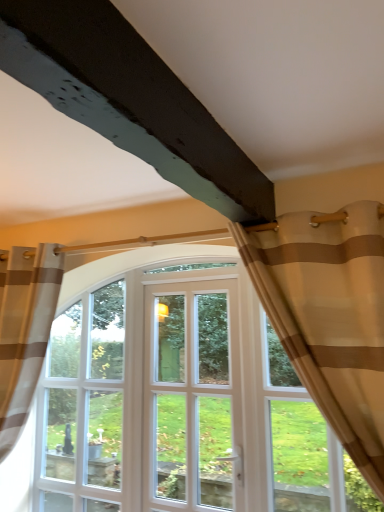
Question: Is brown striped curtain at left, positioned as the 2th curtain in front-to-back order, surrounding beige striped curtain at upper right, which is the first curtain from front to back?

Choices:
 (A) no
 (B) yes

Answer: (A)

Question: Can you confirm if brown striped curtain at left, positioned as the 2th curtain in front-to-back order, is thinner than beige striped curtain at upper right, which is the first curtain from front to back?

Choices:
 (A) yes
 (B) no

Answer: (B)

Question: Is brown striped curtain at left, positioned as the 2th curtain in front-to-back order, facing towards beige striped curtain at upper right, which is the first curtain from front to back?

Choices:
 (A) yes
 (B) no

Answer: (B)

Question: Is brown striped curtain at left, positioned as the 2th curtain in right-to-left order, smaller than beige striped curtain at upper right, which is the first curtain from right to left?

Choices:
 (A) no
 (B) yes

Answer: (A)

Question: Can you confirm if brown striped curtain at left, positioned as the 2th curtain in right-to-left order, is taller than beige striped curtain at upper right, the second curtain viewed from the left?

Choices:
 (A) no
 (B) yes

Answer: (B)

Question: Based on their positions, is beige striped curtain at upper right, the second curtain viewed from the left, located to the left or right of white glass door at center?

Choices:
 (A) left
 (B) right

Answer: (B)

Question: Is beige striped curtain at upper right, which is the second curtain in back-to-front order, bigger or smaller than white glass door at center?

Choices:
 (A) big
 (B) small

Answer: (A)

Question: Is beige striped curtain at upper right, which is the first curtain from right to left, in front of or behind white glass door at center in the image?

Choices:
 (A) behind
 (B) front

Answer: (B)

Question: Looking at their shapes, would you say beige striped curtain at upper right, which is the second curtain in back-to-front order, is wider or thinner than white glass door at center?

Choices:
 (A) thin
 (B) wide

Answer: (B)

Question: From their relative heights in the image, would you say white glass door at center is taller or shorter than beige striped curtain at upper right, which is the first curtain from right to left?

Choices:
 (A) short
 (B) tall

Answer: (B)

Question: Is white glass door at center wider or thinner than beige striped curtain at upper right, the second curtain viewed from the left?

Choices:
 (A) wide
 (B) thin

Answer: (B)

Question: Relative to beige striped curtain at upper right, which is the first curtain from front to back, is white glass door at center in front or behind?

Choices:
 (A) behind
 (B) front

Answer: (A)

Question: Is white glass door at center to the left or to the right of beige striped curtain at upper right, the second curtain viewed from the left, in the image?

Choices:
 (A) left
 (B) right

Answer: (A)

Question: From a real-world perspective, is beige striped curtain at upper right, which is the second curtain in back-to-front order, physically located above or below brown striped curtain at left, positioned as the 2th curtain in right-to-left order?

Choices:
 (A) below
 (B) above

Answer: (B)

Question: Is beige striped curtain at upper right, which is the first curtain from front to back, in front of or behind brown striped curtain at left, marked as the 1th curtain in a back-to-front arrangement, in the image?

Choices:
 (A) behind
 (B) front

Answer: (B)